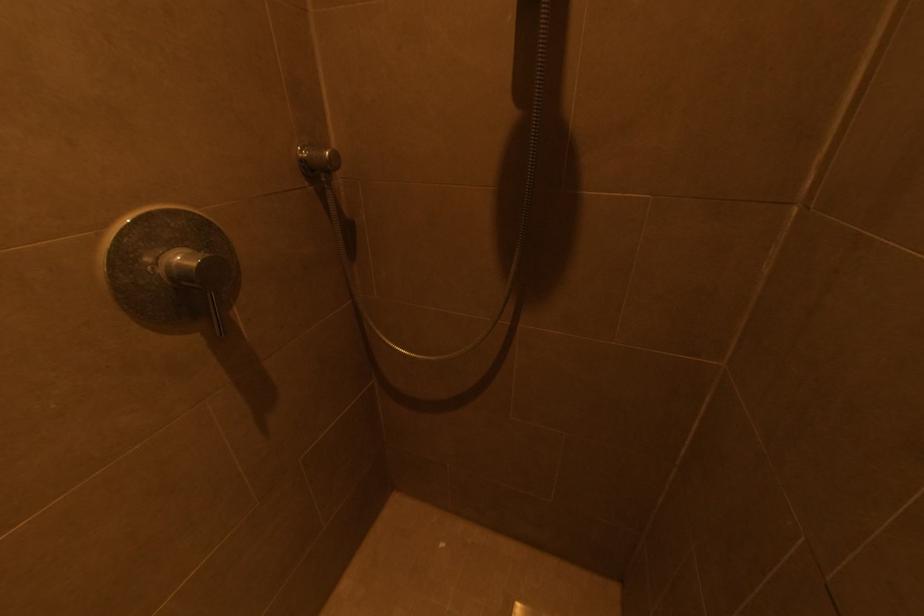
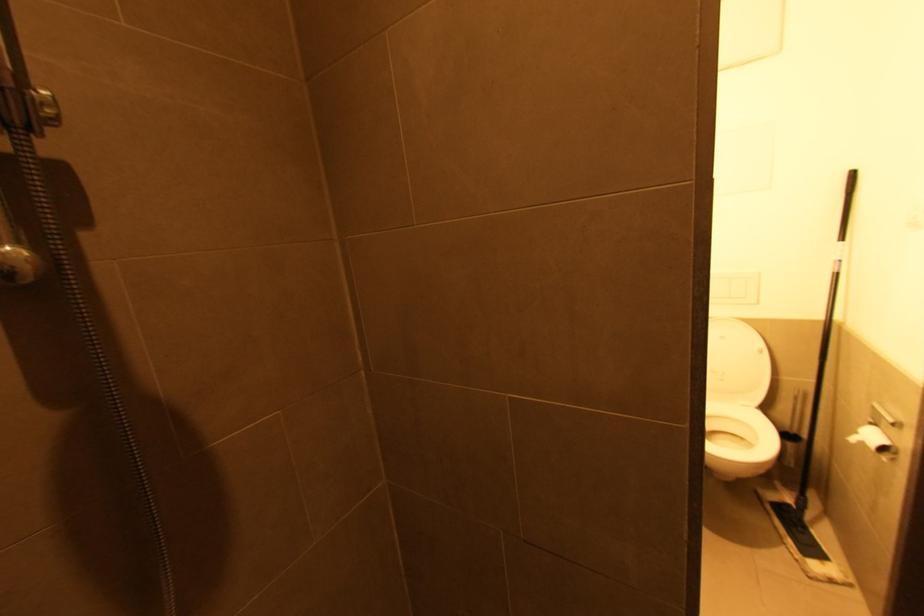
Question: The camera is either moving clockwise (left) or counter-clockwise (right) around the object. The first image is from the beginning of the video and the second image is from the end. Is the camera moving left or right when shooting the video?

Choices:
 (A) Left
 (B) Right

Answer: (A)